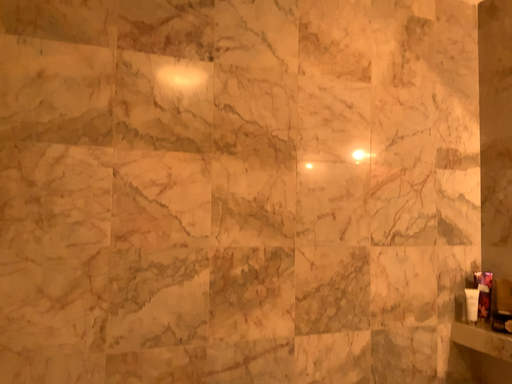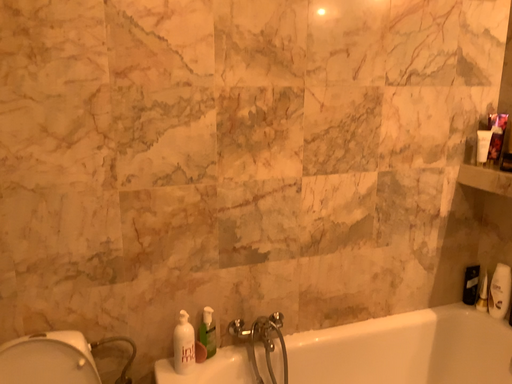
Question: Which way did the camera rotate in the video?

Choices:
 (A) rotated upward
 (B) rotated downward

Answer: (B)